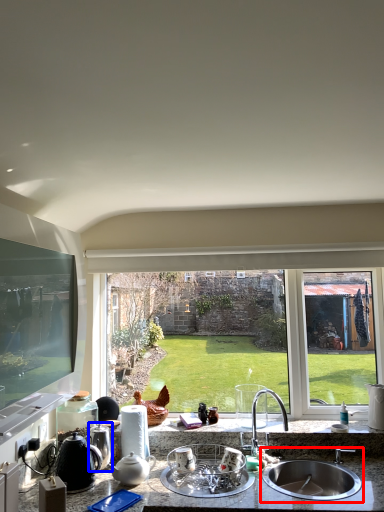
Question: Among these objects, which one is farthest to the camera, sink (highlighted by a red box) or appliance (highlighted by a blue box)?

Choices:
 (A) sink
 (B) appliance

Answer: (B)